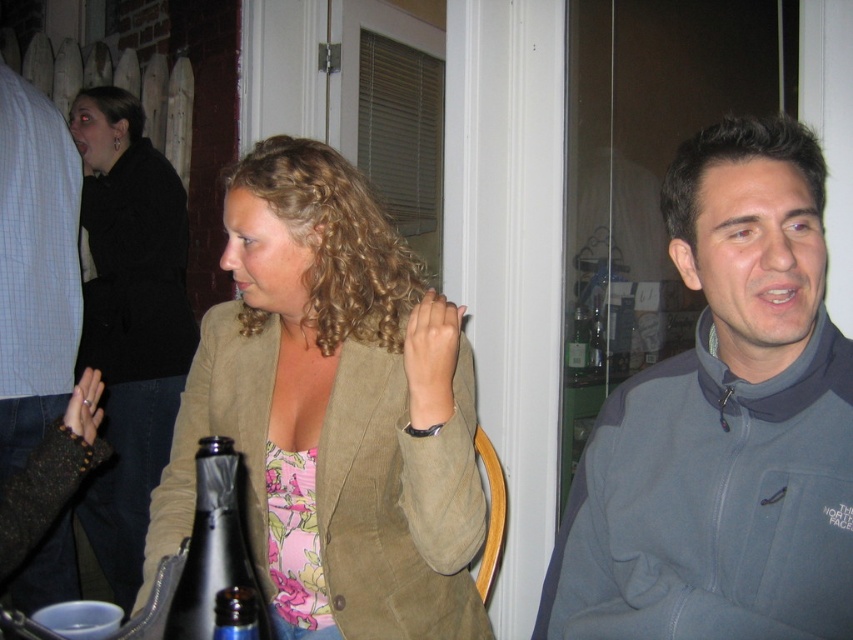
Question: Can you confirm if black matte jacket at upper left is positioned to the right of light blue plaid shirt at left?

Choices:
 (A) yes
 (B) no

Answer: (A)

Question: Can you confirm if silver metallic wine bottle at lower left is positioned to the left of metallic blue bottle at lower left?

Choices:
 (A) yes
 (B) no

Answer: (A)

Question: Which of the following is the farthest from the observer?

Choices:
 (A) clear glass bottle at center
 (B) silver metallic wine bottle at lower left

Answer: (A)

Question: Which is nearer to the silver metallic wine bottle at lower left?

Choices:
 (A) metallic blue bottle at lower left
 (B) suede jacket at center
 (C) light blue plaid shirt at left
 (D) black matte jacket at upper left

Answer: (A)

Question: Can you confirm if suede jacket at center is thinner than clear glass bottle at center?

Choices:
 (A) no
 (B) yes

Answer: (A)

Question: Among these objects, which one is nearest to the camera?

Choices:
 (A) light blue plaid shirt at left
 (B) gray fleece jacket at right

Answer: (B)